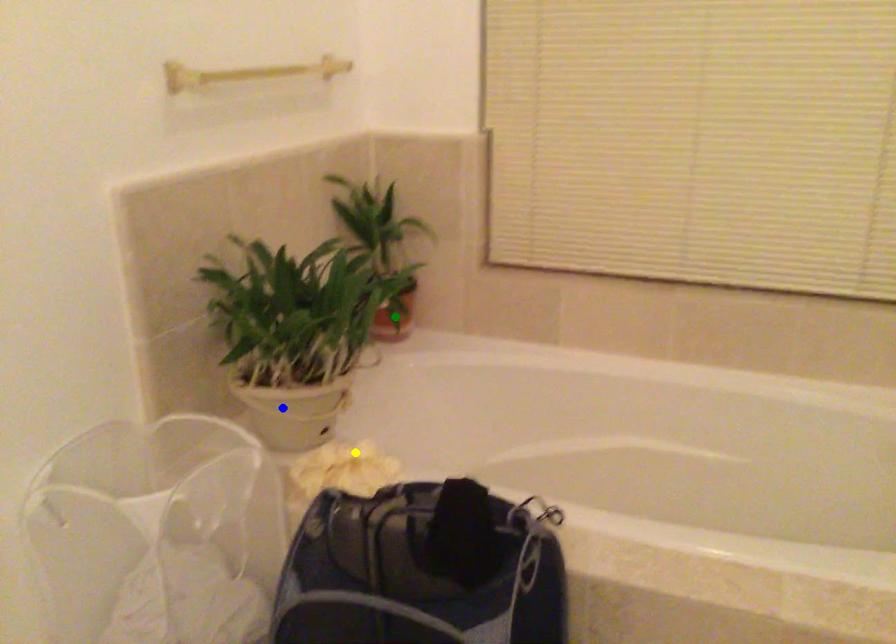
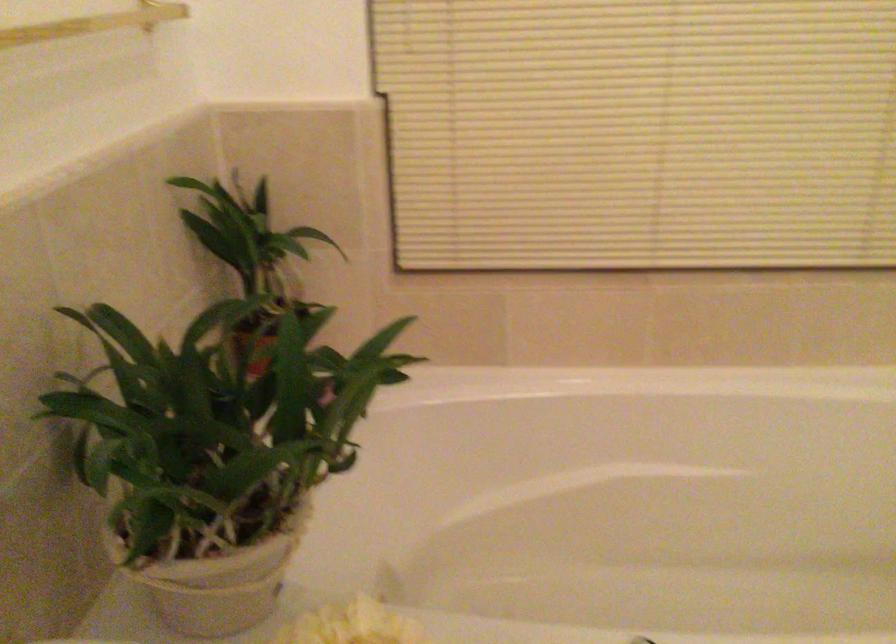
I am providing you with two images of the same scene from different viewpoints. Three points are marked in image1. Which point corresponds to a part or object that is occluded in image2?In image1, three points are marked. Which of them correspond to a part or object that is occluded in image2?Among the three points shown in image1, which one corresponds to a part or object that is no longer visible due to occlusion in image2?

green point cannot be seen in image2.